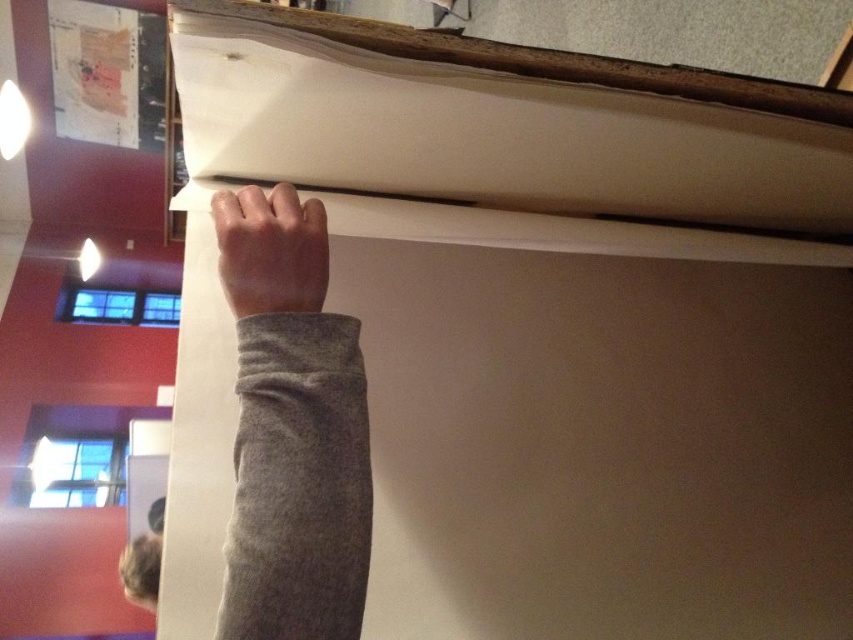
Question: Does gray fleece arm at upper center have a lesser width compared to smooth gray hand at upper center?

Choices:
 (A) no
 (B) yes

Answer: (A)

Question: Which point is farther to the camera?

Choices:
 (A) gray fleece arm at upper center
 (B) smooth gray hand at upper center

Answer: (B)

Question: Does gray fleece arm at upper center appear on the left side of smooth gray hand at upper center?

Choices:
 (A) no
 (B) yes

Answer: (A)

Question: Which object appears farthest from the camera in this image?

Choices:
 (A) smooth gray hand at upper center
 (B) gray fleece arm at upper center

Answer: (A)

Question: Is gray fleece arm at upper center positioned at the back of smooth gray hand at upper center?

Choices:
 (A) yes
 (B) no

Answer: (B)

Question: Which of the following is the farthest from the observer?

Choices:
 (A) (260, 502)
 (B) (308, 305)

Answer: (B)